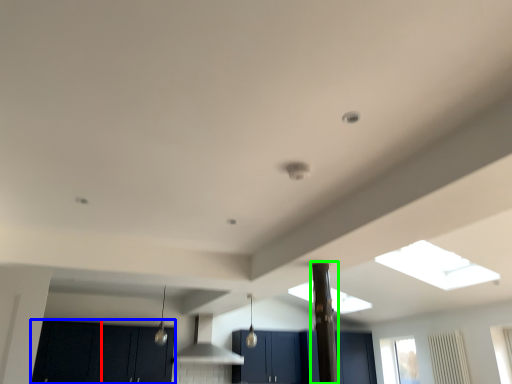
Question: Which is farther away from cabinetry (highlighted by a red box)? cabinetry (highlighted by a blue box) or pillar (highlighted by a green box)?

Choices:
 (A) cabinetry
 (B) pillar

Answer: (B)